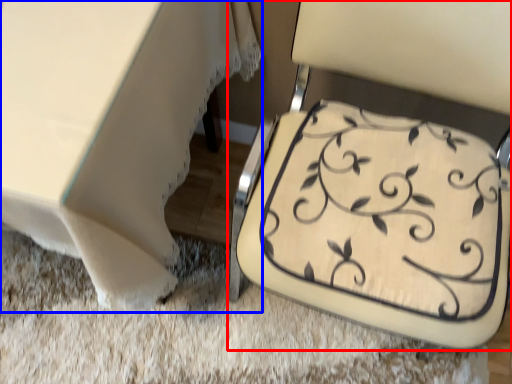
Question: Which point is closer to the camera, chair (highlighted by a red box) or table (highlighted by a blue box)?

Choices:
 (A) chair
 (B) table

Answer: (A)